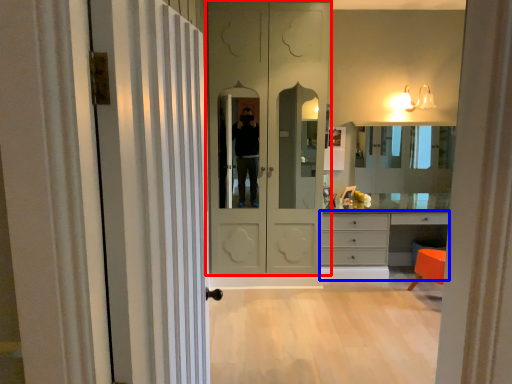
Question: Which object appears farthest to the camera in this image, door (highlighted by a red box) or chest of drawers (highlighted by a blue box)?

Choices:
 (A) door
 (B) chest of drawers

Answer: (B)